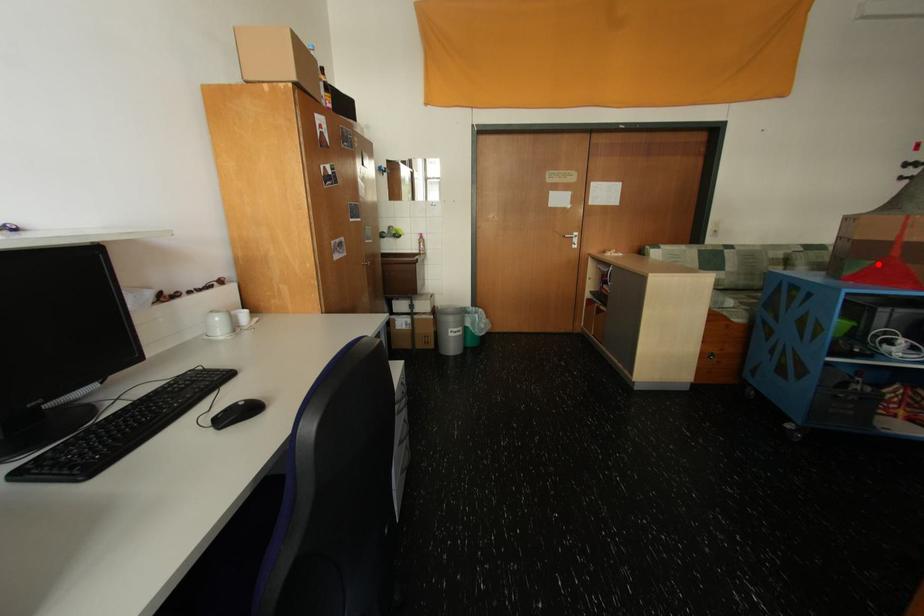
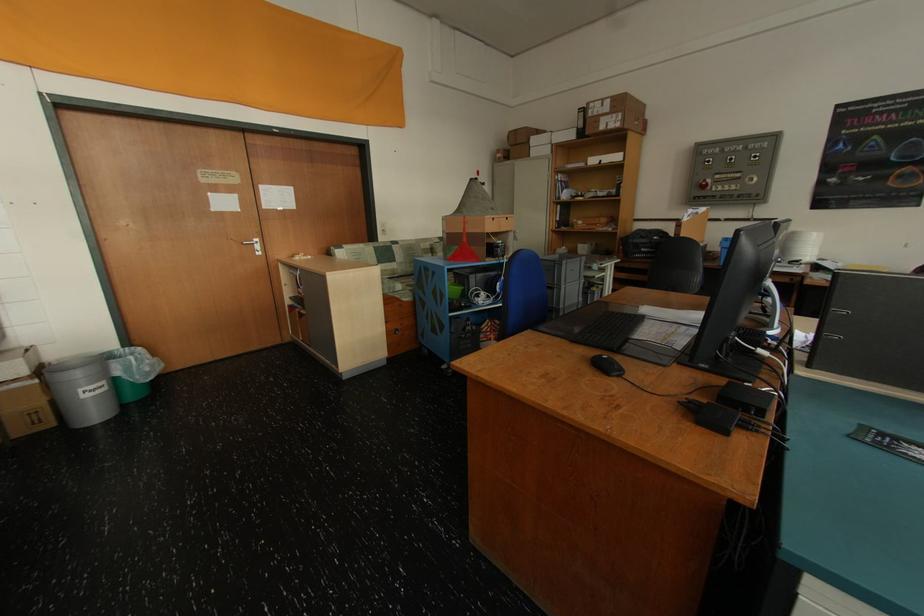
The point at the highlighted location is marked in the first image. Where is the corresponding point in the second image?

(465, 249)